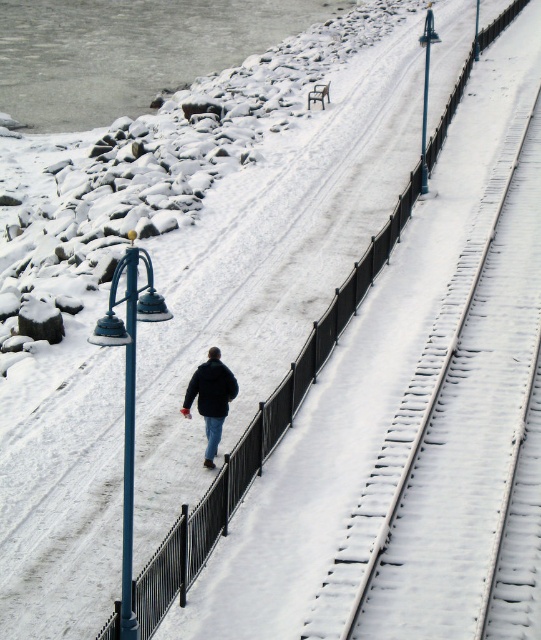
You are a photographer trying to capture both the dark blue jacket at center and the black matte jacket at center in a single shot. Since you want both subjects to be clearly visible, which jacket should you focus on first to ensure the taller one is in sharp focus?

The dark blue jacket at center is taller than the black matte jacket at center, so you should focus on the dark blue jacket at center first to ensure it is in sharp focus.

You are a photographer trying to capture both the dark blue jacket at center and the black matte jacket at center in the same frame. Based on their positions and sizes in the image, which jacket should you focus on to ensure both are visible without cropping?

The dark blue jacket at center might be wider than the black matte jacket at center, so focusing on the wider dark blue jacket at center ensures both are visible in the frame.